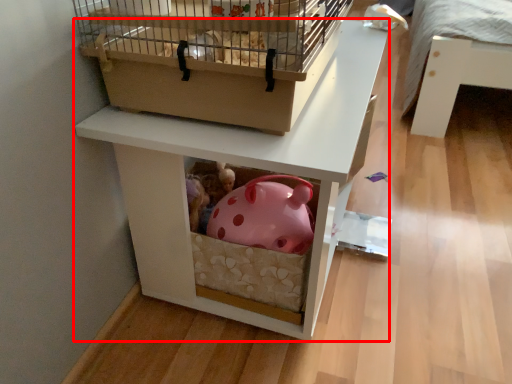
Question: Considering the relative positions of furniture (annotated by the red box) and bird cage in the image provided, where is furniture (annotated by the red box) located with respect to the staircase?

Choices:
 (A) right
 (B) left

Answer: (A)